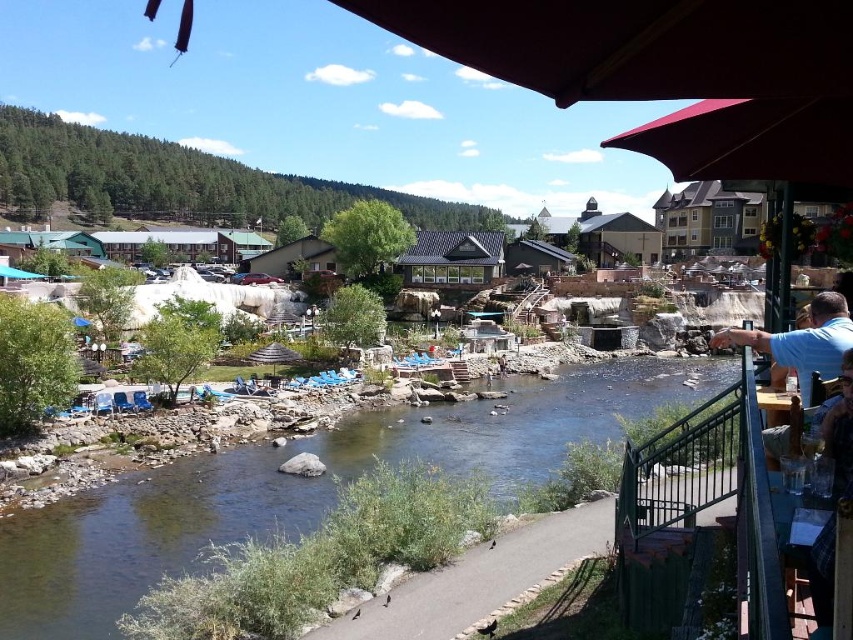
Question: Can you confirm if clear water stream at center is positioned below blue shirt at right?

Choices:
 (A) no
 (B) yes

Answer: (B)

Question: Which point appears farthest from the camera in this image?

Choices:
 (A) (850, 321)
 (B) (140, 525)

Answer: (B)

Question: Does clear water stream at center have a greater width compared to blue shirt at right?

Choices:
 (A) no
 (B) yes

Answer: (B)

Question: Which point is closer to the camera taking this photo?

Choices:
 (A) (833, 317)
 (B) (476, 444)

Answer: (A)

Question: Is clear water stream at center closer to the viewer compared to blue shirt at right?

Choices:
 (A) yes
 (B) no

Answer: (B)